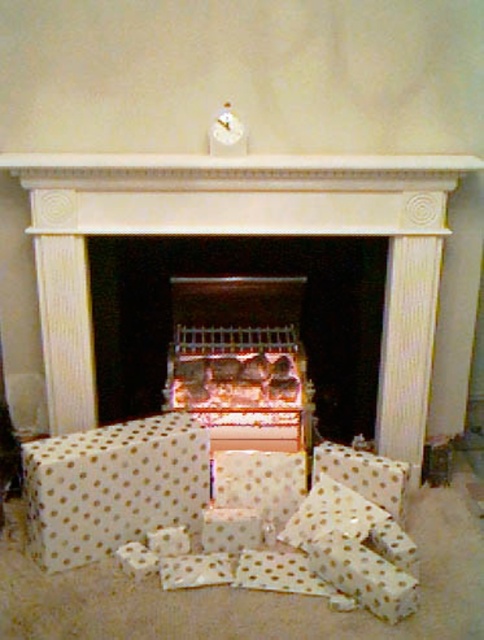
You are planning to place a decorative table next to the wooden fireplace at center. The table is 1.2 meters wide. Based on the scene, can the table fit next to the fireplace without overlapping the white polka dot wrapping paper at lower center?

The wooden fireplace at center is wider than the white polka dot wrapping paper at lower center. Since the fireplace is wider, there should be enough space next to it to place the 1.2 meter table without overlapping the wrapping paper.

Based on the photo, you are standing in a living room and see the white marble fireplace at center and the wooden fireplace at center. Which one is above the other?

The white marble fireplace at center is positioned over the wooden fireplace at center.